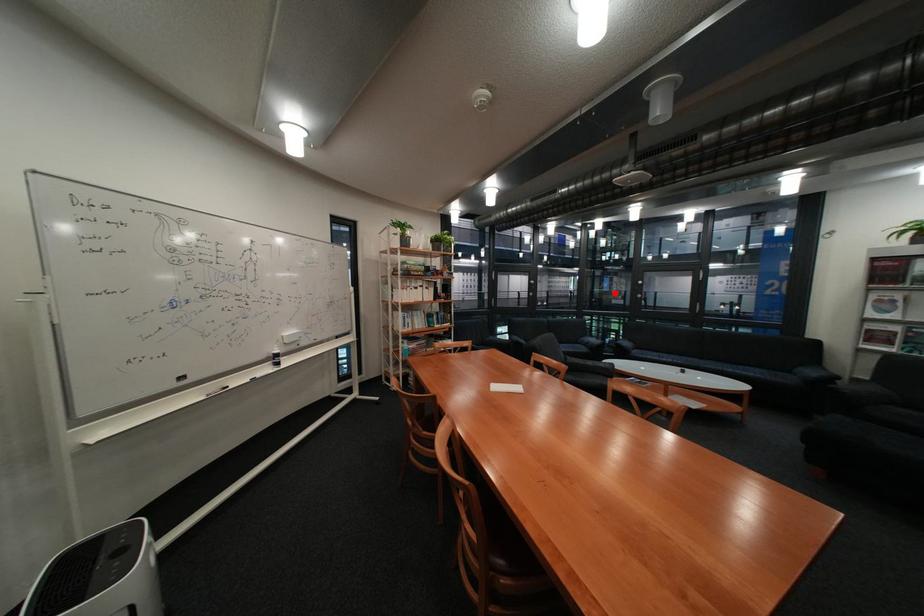
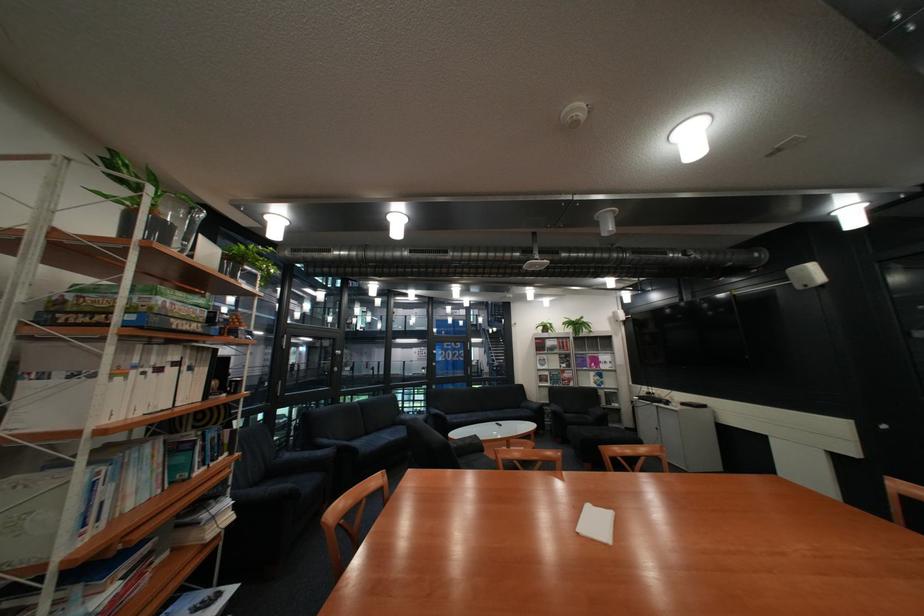
Question: I am providing you with two images of the same scene from different viewpoints. Given a red point in image1, look at the same physical point in image2. Is it:

Choices:
 (A) Closer to the viewpoint
 (B) Farther from the viewpoint

Answer: (B)